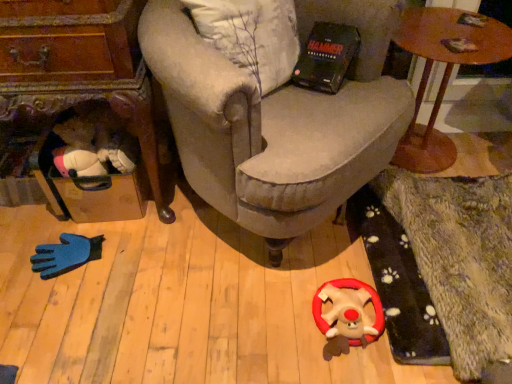
This screenshot has width=512, height=384. Identify the location of free space in front of velvet beige armchair at center. (227, 319).